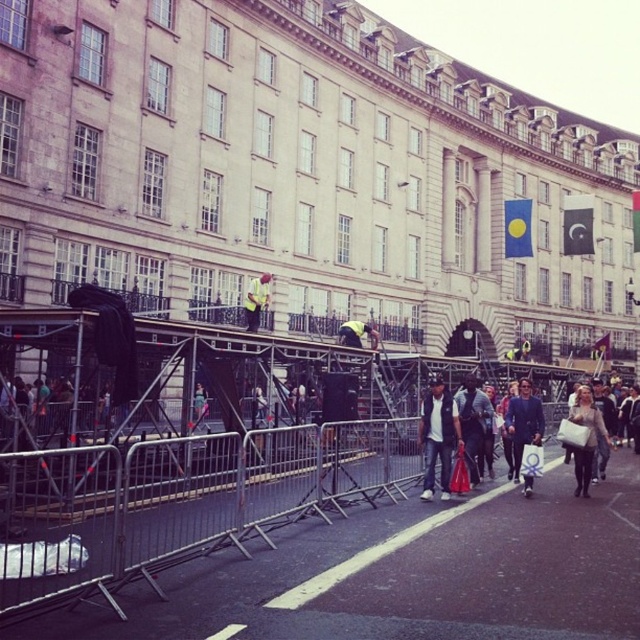
Question: Can you confirm if light brown leather jacket at lower right is thinner than yellow fabric jacket at center?

Choices:
 (A) no
 (B) yes

Answer: (B)

Question: Among these points, which one is nearest to the camera?

Choices:
 (A) click(483, 452)
 (B) click(520, 445)
 (C) click(579, 410)
 (D) click(438, 380)

Answer: (C)

Question: Does matte black backpack at center appear on the left side of yellow fabric jacket at center?

Choices:
 (A) no
 (B) yes

Answer: (A)

Question: From the image, what is the correct spatial relationship of dark blue suit at center in relation to yellow fabric at center?

Choices:
 (A) below
 (B) above

Answer: (A)

Question: Which of the following is the closest to the observer?

Choices:
 (A) yellow fabric at center
 (B) light brown leather jacket at lower right
 (C) yellow fabric jacket at center

Answer: (B)

Question: Which of the following is the closest to the observer?

Choices:
 (A) (436, 410)
 (B) (481, 449)
 (C) (372, 340)
 (D) (515, 477)

Answer: (A)